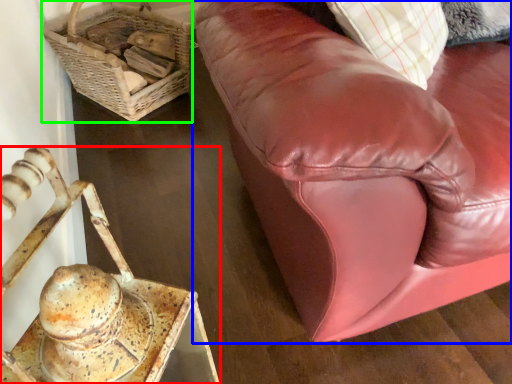
Question: Estimate the real-world distances between objects in this image. Which object is farther from furniture (highlighted by a red box), studio couch (highlighted by a blue box) or basket (highlighted by a green box)?

Choices:
 (A) studio couch
 (B) basket

Answer: (B)